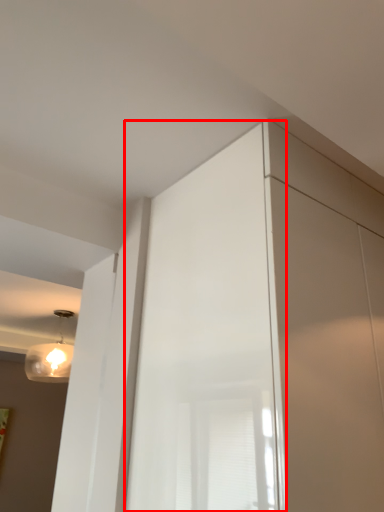
Question: From the image's perspective, what is the correct spatial relationship of screen door (annotated by the red box) in relation to lamp?

Choices:
 (A) below
 (B) above

Answer: (B)